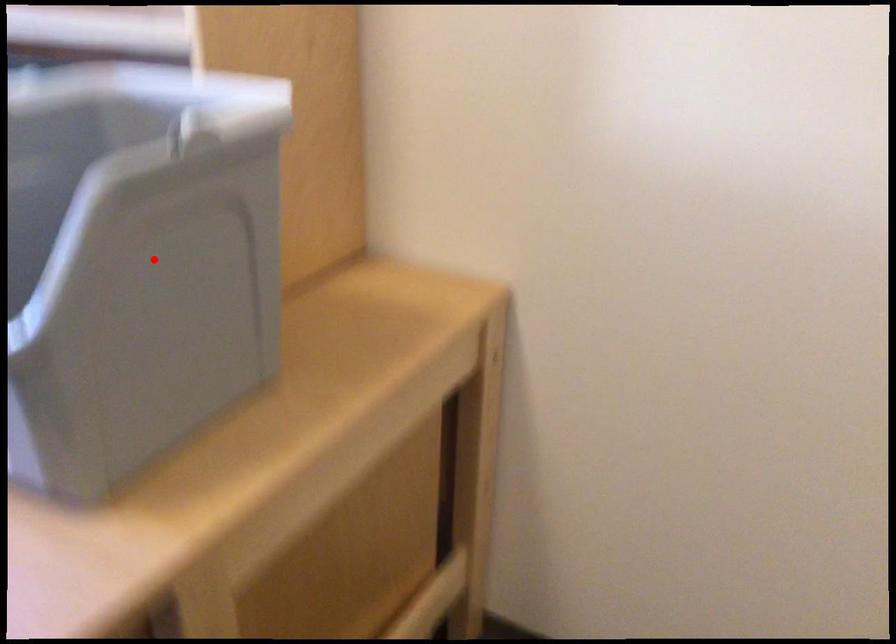
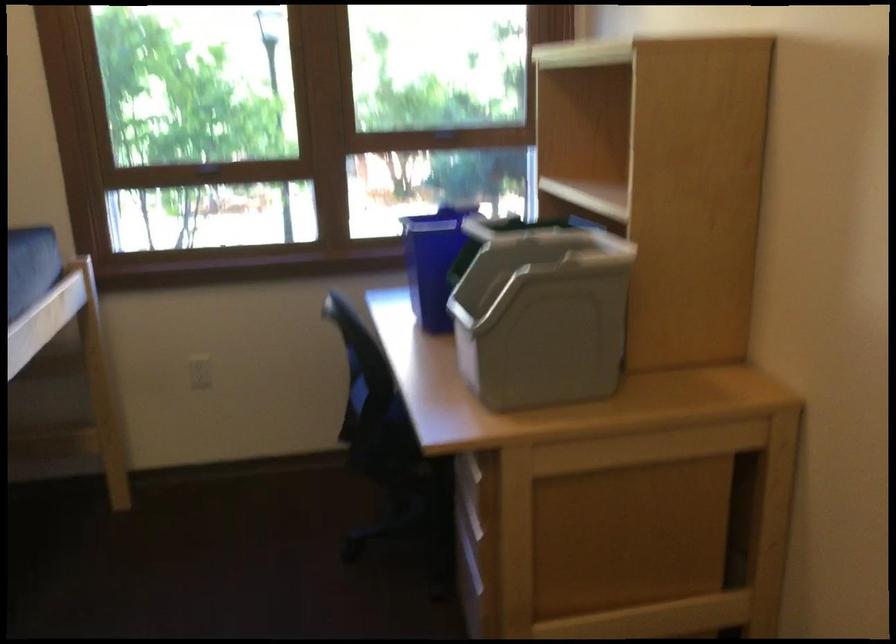
Question: I am providing you with two images of the same scene from different viewpoints. In image1, a red point is highlighted. Considering the same 3D point in image2, which of the following is correct?

Choices:
 (A) It is closer
 (B) It is farther

Answer: (B)